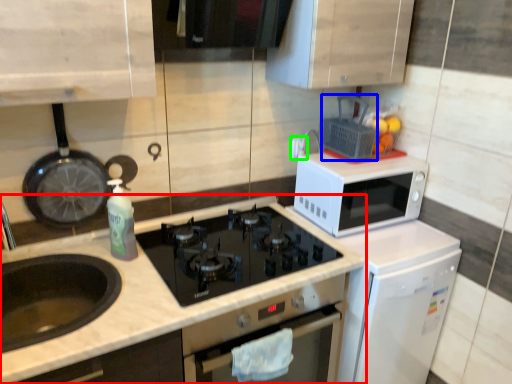
Question: Which object is the farthest from countertop (highlighted by a red box)? Choose among these: appliance (highlighted by a blue box) or electric outlet (highlighted by a green box).

Choices:
 (A) appliance
 (B) electric outlet

Answer: (B)